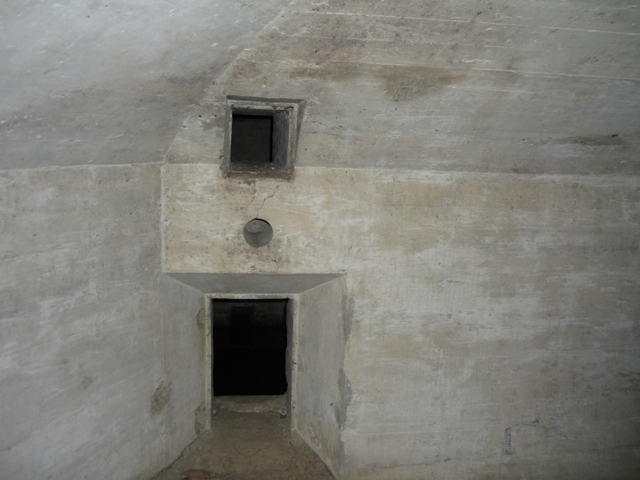
Where is `cement walls`? This screenshot has height=480, width=640. cement walls is located at coordinates (449, 286), (77, 260), (186, 350), (324, 332), (198, 196).